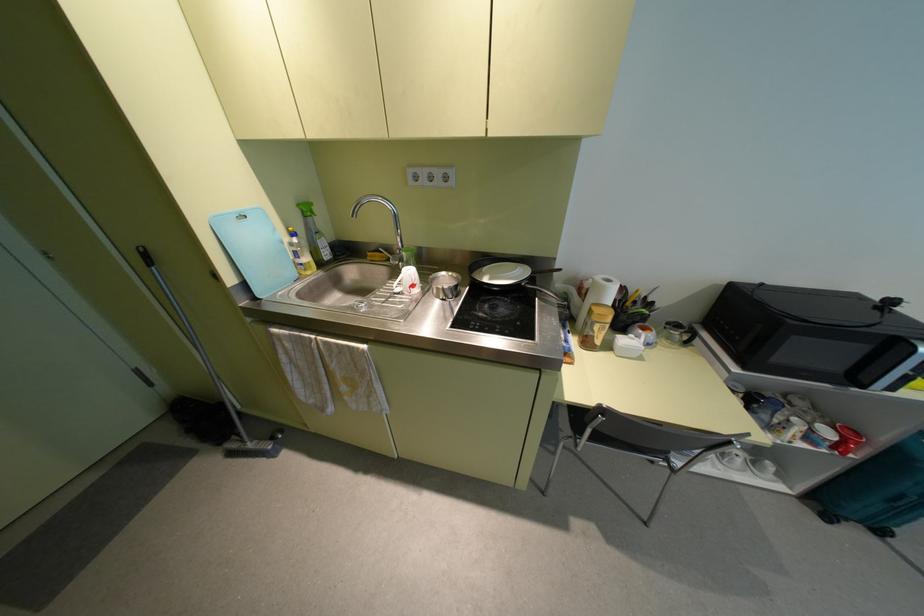
Identify the location of black mug handle. The image size is (924, 616). [x=689, y=334].